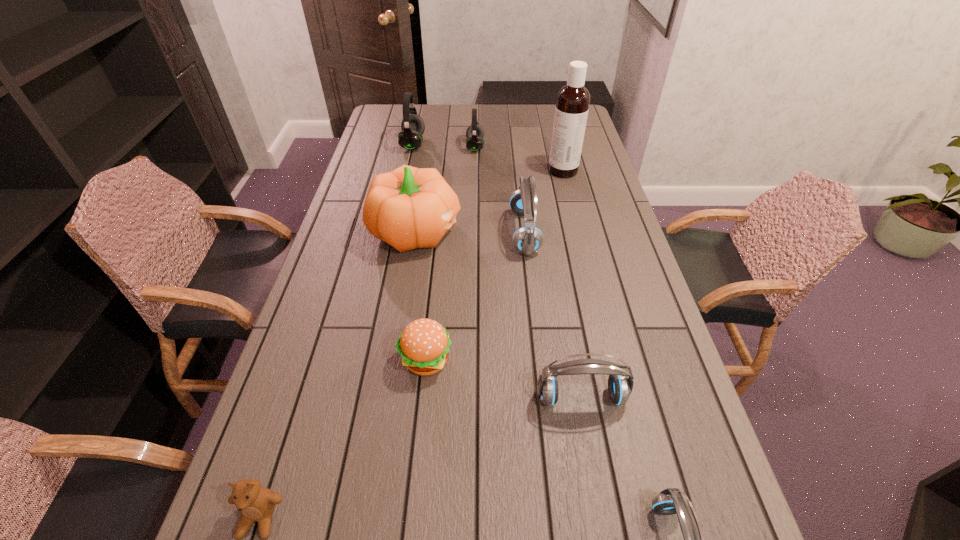
Find the location of a particular element. This screenshot has height=540, width=960. the second farthest blue headset is located at coordinates (620, 387).

At what (x,y) coordinates should I click in order to perform the action: click on the sixth farthest object. Please return your answer as a coordinate pair (x, y). The height and width of the screenshot is (540, 960). Looking at the image, I should click on (424, 344).

In order to click on vacant region located on the label side of the seventh nearest object in this screenshot , I will do `click(494, 171)`.

In order to click on free space located 0.160m on the label side of the seventh nearest object in this screenshot , I will do `click(506, 171)`.

Find the location of a particular element. free point located 0.150m on the label side of the seventh nearest object is located at coordinates (508, 171).

Find the location of a particular element. The width and height of the screenshot is (960, 540). vacant area situated 0.060m on the carved face of the pumpkin is located at coordinates (480, 231).

What are the coordinates of `free space located on the ear cups of the leftmost headset` in the screenshot? It's located at (479, 144).

You are a GUI agent. You are given a task and a screenshot of the screen. Output one action in this format:
    pyautogui.click(x=<x>, y=<y>)
    Task: Click on the free space located on the ear cups of the farthest blue headset
    
    Given the screenshot: What is the action you would take?
    pyautogui.click(x=400, y=232)

The width and height of the screenshot is (960, 540). I want to click on free point located 0.290m on the ear cups of the farthest blue headset, so click(419, 232).

The width and height of the screenshot is (960, 540). What are the coordinates of `vacant area situated on the ear cups of the farthest blue headset` in the screenshot? It's located at (482, 232).